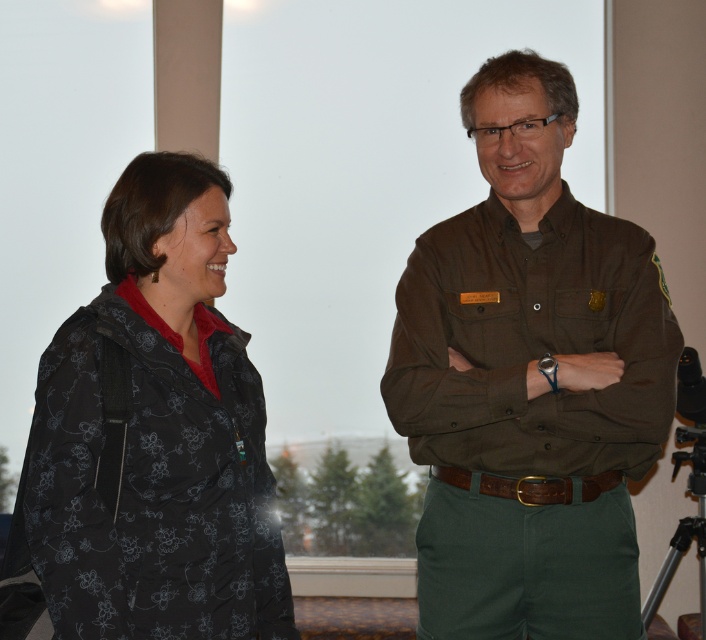
Between brown uniform at right and black metal tripod at lower right, which one has more height?

brown uniform at right

Does brown uniform at right appear on the right side of black metal tripod at lower right?

Incorrect, brown uniform at right is not on the right side of black metal tripod at lower right.

Describe the element at coordinates (532, 307) in the screenshot. I see `brown uniform at right` at that location.

Locate an element on the screen. brown uniform at right is located at coordinates (532, 307).

Does point (138, 333) come farther from viewer compared to point (538, 497)?

No, (138, 333) is in front of (538, 497).

Does black floral-patterned jacket at left have a larger size compared to brown leather belt at center?

Yes.

Is point (164, 177) closer to camera compared to point (496, 477)?

Yes, it is in front of point (496, 477).

You are a GUI agent. You are given a task and a screenshot of the screen. Output one action in this format:
    pyautogui.click(x=<x>, y=<y>)
    Task: Click on the black floral-patterned jacket at left
    
    Given the screenshot: What is the action you would take?
    pyautogui.click(x=150, y=438)

Who is positioned more to the right, brown uniform at right or brown leather belt at center?

Positioned to the right is brown uniform at right.

In the scene shown: Does brown uniform at right have a greater height compared to brown leather belt at center?

Indeed, brown uniform at right has a greater height compared to brown leather belt at center.

Looking at this image, who is more distant from viewer, [573,104] or [520,490]?

Point [573,104]

Find the location of a particular element. This screenshot has width=706, height=640. brown uniform at right is located at coordinates (532, 307).